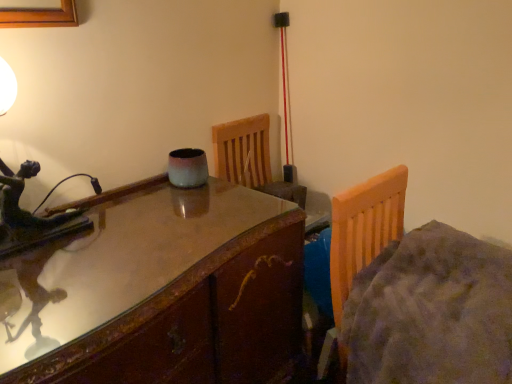
Question: Considering the positions of point (338, 258) and point (103, 312), is point (338, 258) closer or farther from the camera than point (103, 312)?

Choices:
 (A) closer
 (B) farther

Answer: (B)

Question: Is fuzzy gray bed at right wider or thinner than glossy wood table at center?

Choices:
 (A) thin
 (B) wide

Answer: (A)

Question: From the image's perspective, is fuzzy gray bed at right located above or below glossy wood table at center?

Choices:
 (A) below
 (B) above

Answer: (B)

Question: Is glossy wood table at center taller or shorter than fuzzy gray bed at right?

Choices:
 (A) short
 (B) tall

Answer: (B)

Question: Looking at the image, does glossy wood table at center seem bigger or smaller compared to fuzzy gray bed at right?

Choices:
 (A) big
 (B) small

Answer: (A)

Question: Considering the relative positions of glossy wood table at center and fuzzy gray bed at right in the image provided, is glossy wood table at center to the left or to the right of fuzzy gray bed at right?

Choices:
 (A) left
 (B) right

Answer: (A)

Question: In terms of width, does glossy wood table at center look wider or thinner when compared to fuzzy gray bed at right?

Choices:
 (A) thin
 (B) wide

Answer: (B)